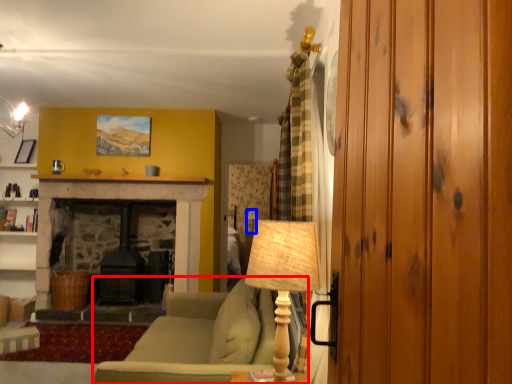
Question: Which of the following is the farthest to the observer, studio couch (highlighted by a red box) or table lamp (highlighted by a blue box)?

Choices:
 (A) studio couch
 (B) table lamp

Answer: (B)